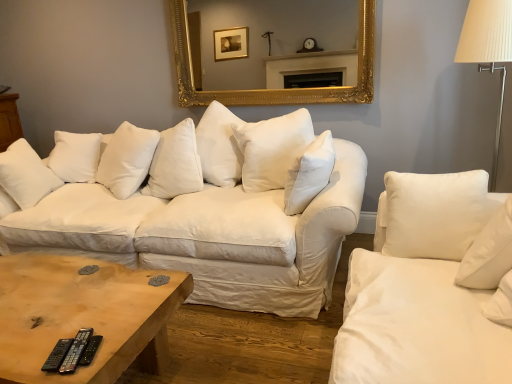
Where is `free spot to the left of black rubber remote at lower left, the second remote in the right-to-left sequence`? free spot to the left of black rubber remote at lower left, the second remote in the right-to-left sequence is located at coordinates (32, 344).